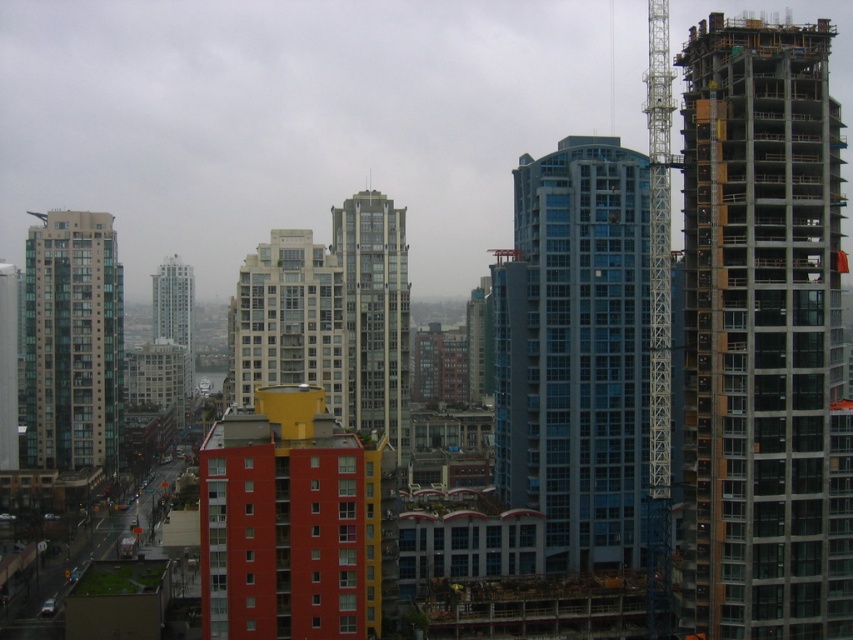
Is glassy steel building at center in front of matte glass skyscraper at center?

That is True.

Is glassy steel building at center thinner than matte glass skyscraper at center?

Correct, glassy steel building at center's width is less than matte glass skyscraper at center's.

Is point (363, 376) less distant than point (184, 342)?

Yes.

Where is `glassy steel building at center`? glassy steel building at center is located at coordinates pyautogui.click(x=375, y=314).

Is matte glass building at left bigger than matte glass skyscraper at center?

Actually, matte glass building at left might be smaller than matte glass skyscraper at center.

Where is `matte glass building at left`? The width and height of the screenshot is (853, 640). matte glass building at left is located at coordinates (73, 342).

Looking at this image, who is taller, concrete/wooden construction at right or matte glass building at center?

concrete/wooden construction at right

Does concrete/wooden construction at right appear on the right side of matte glass building at center?

Yes, concrete/wooden construction at right is to the right of matte glass building at center.

Between point (766, 253) and point (279, 269), which one is positioned behind?

Point (279, 269)

The image size is (853, 640). I want to click on concrete/wooden construction at right, so click(762, 336).